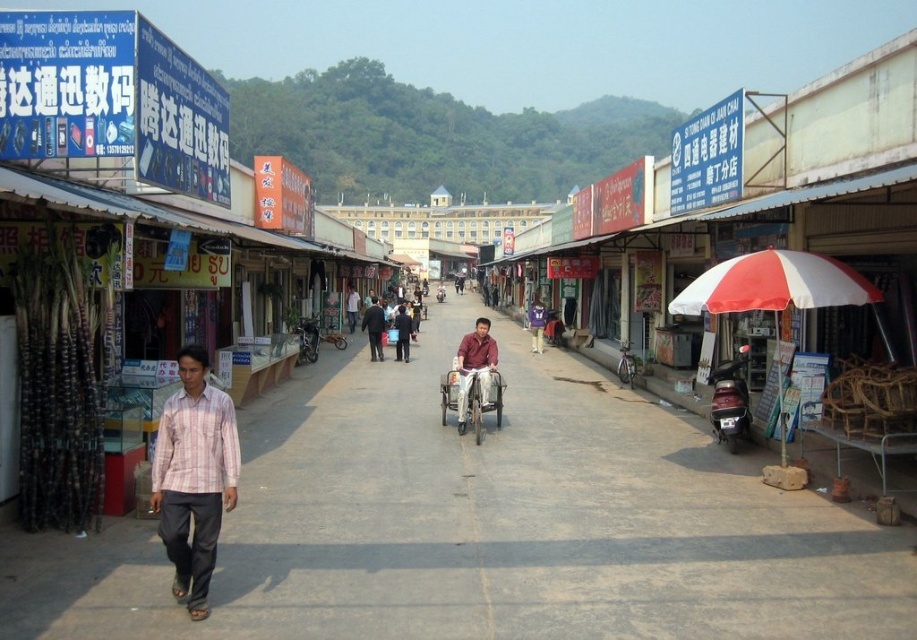
Is pink plaid shirt at left taller than dark gray pants at center?

No, pink plaid shirt at left is not taller than dark gray pants at center.

Does pink plaid shirt at left appear over dark gray pants at center?

No, pink plaid shirt at left is not above dark gray pants at center.

Does point (186, 368) come farther from viewer compared to point (369, 323)?

No, it is not.

You are a GUI agent. You are given a task and a screenshot of the screen. Output one action in this format:
    pyautogui.click(x=<x>, y=<y>)
    Task: Click on the pink plaid shirt at left
    This screenshot has height=640, width=917.
    Given the screenshot: What is the action you would take?
    [194, 476]

Consider the image. Does dark gray pants at center have a smaller size compared to light brown shirt at center?

No, dark gray pants at center is not smaller than light brown shirt at center.

Locate an element on the screen. The image size is (917, 640). dark gray pants at center is located at coordinates (374, 328).

Identify the location of dark gray pants at center. (374, 328).

Identify the location of pink plaid shirt at left. This screenshot has height=640, width=917. (194, 476).

Does pink plaid shirt at left lie in front of purple fabric shirt at center?

That is True.

This screenshot has height=640, width=917. Identify the location of pink plaid shirt at left. (194, 476).